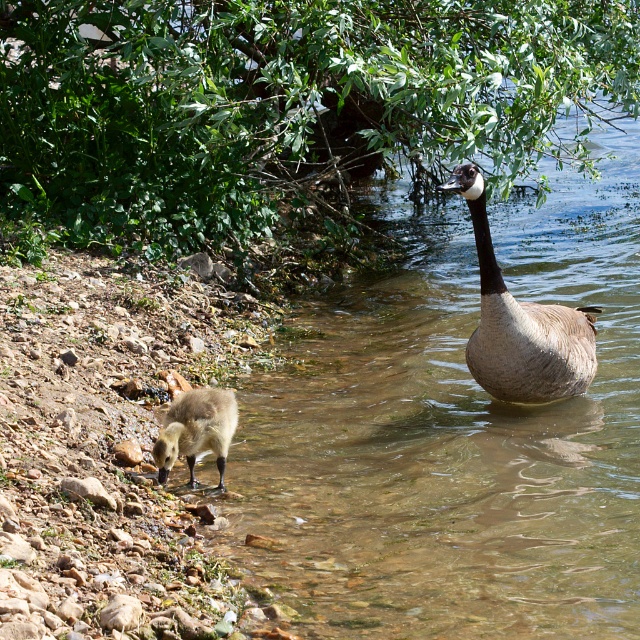
Question: Which object is positioned closest to the brown fuzzy duckling at lower left?

Choices:
 (A) brown feathered goose at right
 (B) clear water at goose right

Answer: (B)

Question: Does clear water at goose right have a lesser width compared to brown feathered goose at right?

Choices:
 (A) yes
 (B) no

Answer: (B)

Question: Does clear water at goose right appear on the right side of brown feathered goose at right?

Choices:
 (A) yes
 (B) no

Answer: (B)

Question: Which point is closer to the camera taking this photo?

Choices:
 (A) (509, 392)
 (B) (525, 211)

Answer: (A)

Question: Is brown feathered goose at right to the left of brown fuzzy duckling at lower left from the viewer's perspective?

Choices:
 (A) no
 (B) yes

Answer: (A)

Question: Which object is positioned closest to the brown feathered goose at right?

Choices:
 (A) clear water at goose right
 (B) brown fuzzy duckling at lower left

Answer: (A)